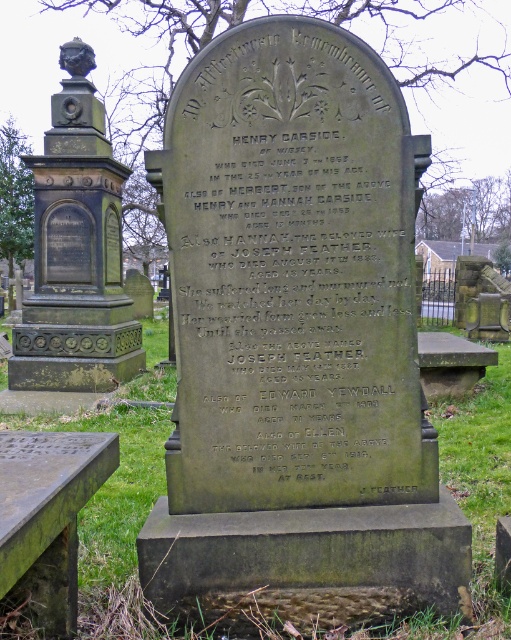
Consider the image. You are a historian examining the dark gray stone tombstone at center and the dark gray stone inscription at center. Which object has a greater width?

The dark gray stone tombstone at center has a greater width than the dark gray stone inscription at center.

You are a visitor at the cemetery and want to take a photo of both the dark gray stone tombstone at center and the dark gray stone monument at center. Which one should you focus on first if you want to capture both in the frame without moving the camera?

The dark gray stone tombstone at center is not as tall as the dark gray stone monument at center, so you should focus on the taller dark gray stone monument at center first to ensure it fits in the frame.